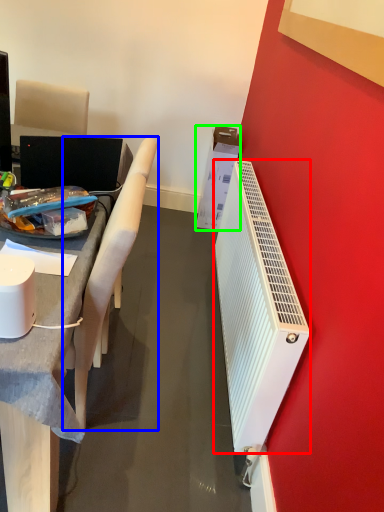
Question: Estimate the real-world distances between objects in this image. Which object is closer to radiator (highlighted by a red box), chair (highlighted by a blue box) or box (highlighted by a green box)?

Choices:
 (A) chair
 (B) box

Answer: (A)